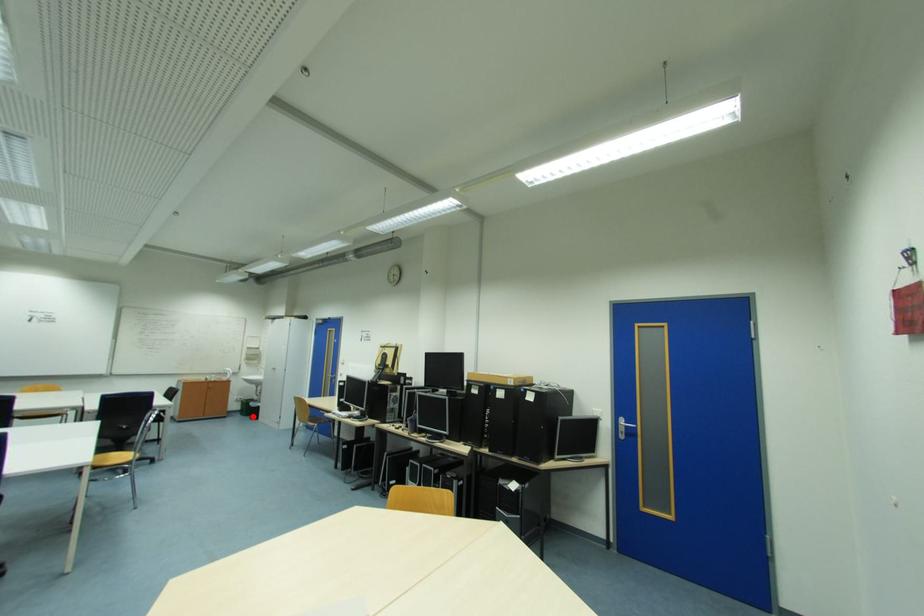
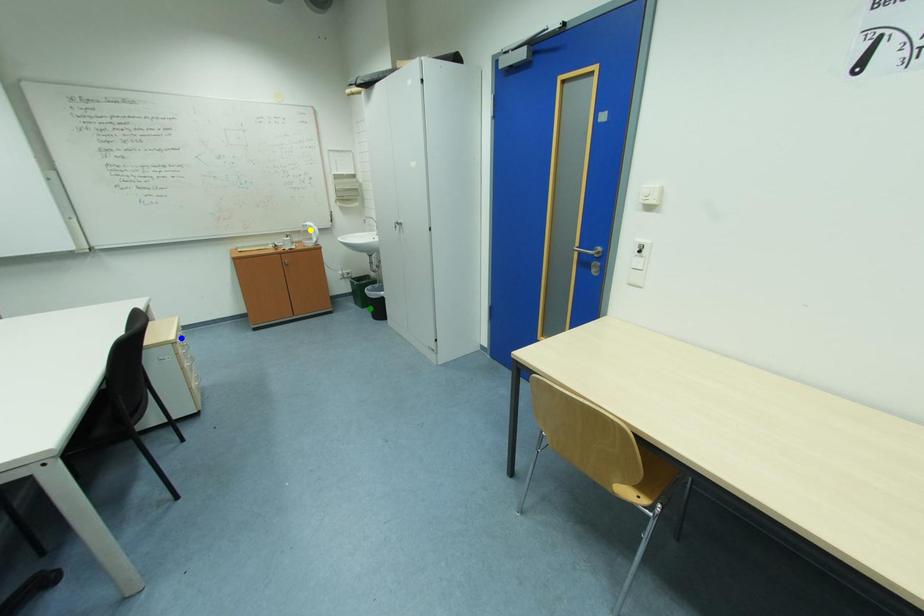
Question: I am providing you with two images of the same scene from different viewpoints. A red point is marked on the first image. You are given multiple points on the second image. In image 2, which mark is for the same physical point as the one in image 1?

Choices:
 (A) blue point
 (B) green point
 (C) yellow point

Answer: (B)